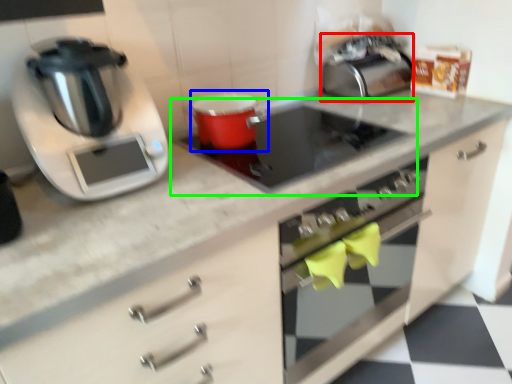
Question: Based on their relative distances, which object is nearer to toaster (highlighted by a red box)? Choose from appliance (highlighted by a blue box) and gas stove (highlighted by a green box).

Choices:
 (A) appliance
 (B) gas stove

Answer: (B)